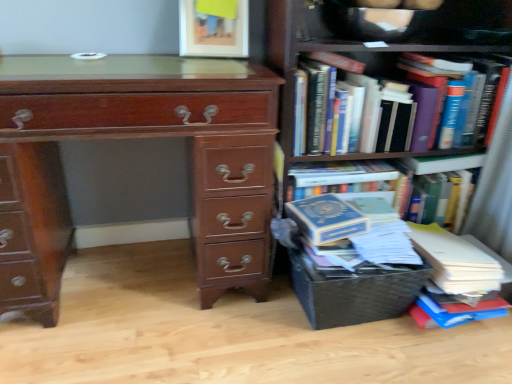
Question: Would you say hardcover books at upper right, which ranks as the second book in bottom-to-top order, is to the left or to the right of woven brown crate at lower right in the picture?

Choices:
 (A) right
 (B) left

Answer: (A)

Question: Looking at their shapes, would you say hardcover books at upper right, the 1th book from the top, is wider or thinner than woven brown crate at lower right?

Choices:
 (A) wide
 (B) thin

Answer: (A)

Question: Which of these objects is positioned closest to the shiny brown wooden chest of drawers at left?

Choices:
 (A) blue hardcover book at right, positioned as the 1th book in bottom-to-top order
 (B) hardcover books at right
 (C) woven brown crate at lower right
 (D) hardcover books at upper right, which ranks as the second book in bottom-to-top order

Answer: (B)

Question: Based on their relative distances, which object is nearer to the shiny brown wooden chest of drawers at left?

Choices:
 (A) hardcover books at right
 (B) blue hardcover book at right, positioned as the second book in top-to-bottom order
 (C) woven brown crate at lower right
 (D) hardcover books at upper right, the 1th book from the top

Answer: (A)